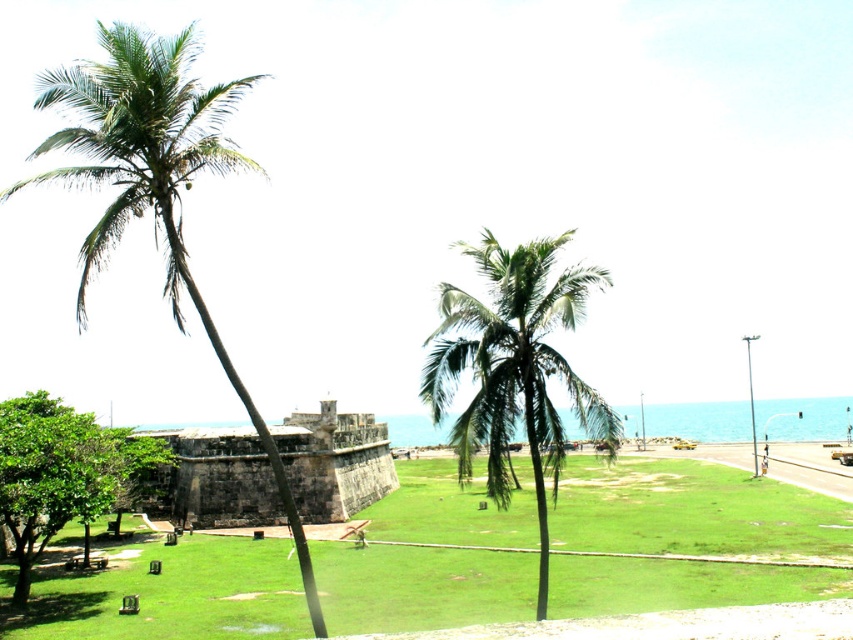
Is green grassy at center thinner than green leafy coconut tree at center?

In fact, green grassy at center might be wider than green leafy coconut tree at center.

Who is more forward, (328, 604) or (502, 403)?

Point (502, 403)

Consider the image. Who is more forward, (408, 554) or (444, 312)?

Point (444, 312) is more forward.

Identify the location of green grassy at center. The height and width of the screenshot is (640, 853). (428, 560).

Who is shorter, green leafy coconut tree at center or brown stone fort at center?

brown stone fort at center is shorter.

Is the position of green leafy coconut tree at center more distant than that of brown stone fort at center?

That is False.

Image resolution: width=853 pixels, height=640 pixels. Identify the location of green leafy coconut tree at center. (514, 365).

Can you confirm if green leafy palm tree at left is shorter than brown stone fort at center?

Incorrect, green leafy palm tree at left's height does not fall short of brown stone fort at center's.

Which is below, green leafy palm tree at left or brown stone fort at center?

brown stone fort at center is lower down.

The width and height of the screenshot is (853, 640). What do you see at coordinates (154, 180) in the screenshot?
I see `green leafy palm tree at left` at bounding box center [154, 180].

Where is `green leafy palm tree at left`? green leafy palm tree at left is located at coordinates (154, 180).